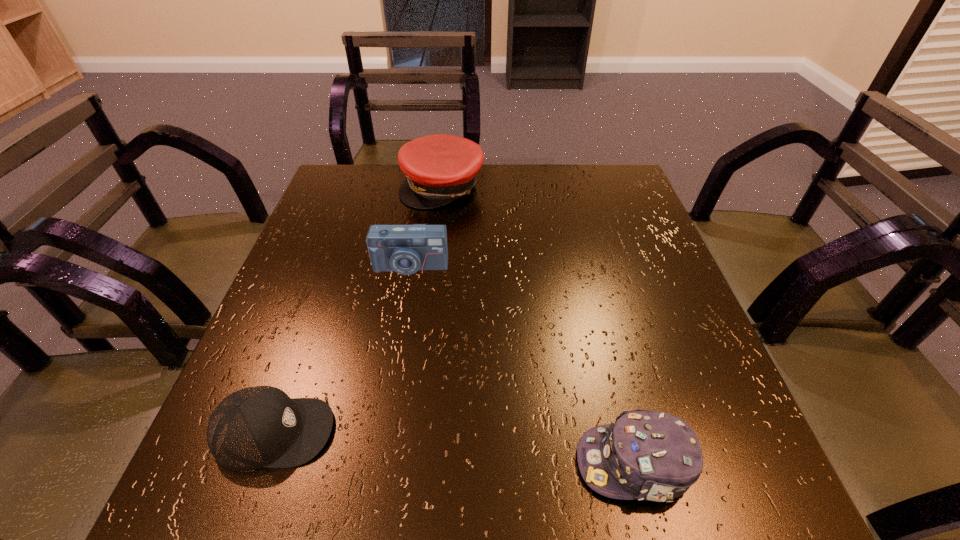
Identify the location of vacant space at the far left corner of the desktop. The width and height of the screenshot is (960, 540). (365, 202).

Where is `free space at the far right corner`? free space at the far right corner is located at coordinates (588, 165).

The image size is (960, 540). In the image, there is a desktop. What are the coordinates of `free space at the near right corner` in the screenshot? It's located at (728, 491).

Image resolution: width=960 pixels, height=540 pixels. In order to click on free spot between the second farthest object and the leftmost headwear in this screenshot , I will do `click(342, 349)`.

You are a GUI agent. You are given a task and a screenshot of the screen. Output one action in this format:
    pyautogui.click(x=<x>, y=<y>)
    Task: Click on the free area in between the leftmost headwear and the rightmost object
    
    Given the screenshot: What is the action you would take?
    pyautogui.click(x=455, y=448)

Image resolution: width=960 pixels, height=540 pixels. In order to click on free point between the rightmost object and the farthest headwear in this screenshot , I will do `click(539, 325)`.

Locate an element on the screen. vacant area that lies between the rightmost object and the leftmost headwear is located at coordinates (455, 448).

You are a GUI agent. You are given a task and a screenshot of the screen. Output one action in this format:
    pyautogui.click(x=<x>, y=<y>)
    Task: Click on the unoccupied area between the leftmost headwear and the rightmost object
    This screenshot has height=540, width=960.
    Given the screenshot: What is the action you would take?
    tap(455, 448)

This screenshot has height=540, width=960. Find the location of `free space between the third nearest object and the rightmost object`. free space between the third nearest object and the rightmost object is located at coordinates (522, 365).

I want to click on free area in between the second farthest object and the leftmost headwear, so click(x=342, y=349).